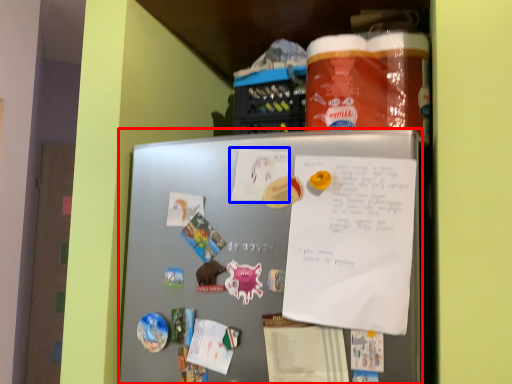
Question: Which object appears closest to the camera in this image, refrigerator (highlighted by a red box) or paper (highlighted by a blue box)?

Choices:
 (A) refrigerator
 (B) paper

Answer: (A)